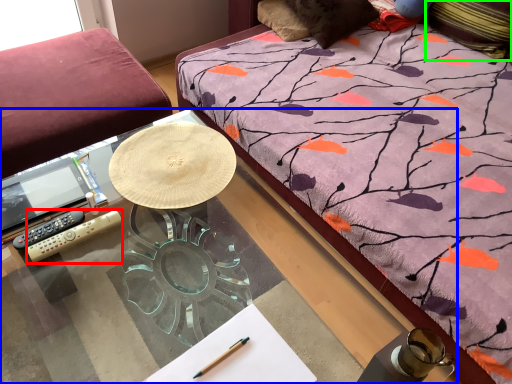
Question: Based on their relative distances, which object is nearer to remote control (highlighted by a red box)? Choose from desk (highlighted by a blue box) and pillow (highlighted by a green box).

Choices:
 (A) desk
 (B) pillow

Answer: (A)